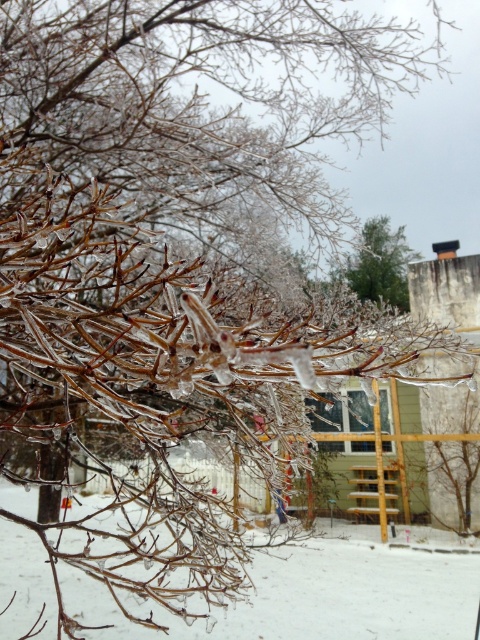
Question: Which of the following is the closest to the observer?

Choices:
 (A) green matte tree at upper center
 (B) white frosty snow at lower left

Answer: (B)

Question: Observing the image, what is the correct spatial positioning of white frosty snow at lower left in reference to green matte tree at upper center?

Choices:
 (A) below
 (B) above

Answer: (A)

Question: Does white frosty snow at lower left have a larger size compared to green matte tree at upper center?

Choices:
 (A) yes
 (B) no

Answer: (A)

Question: Can you confirm if white frosty snow at lower left is positioned to the right of green matte tree at upper center?

Choices:
 (A) yes
 (B) no

Answer: (B)

Question: Which object is farther from the camera taking this photo?

Choices:
 (A) green matte tree at upper center
 (B) white frosty snow at lower left

Answer: (A)